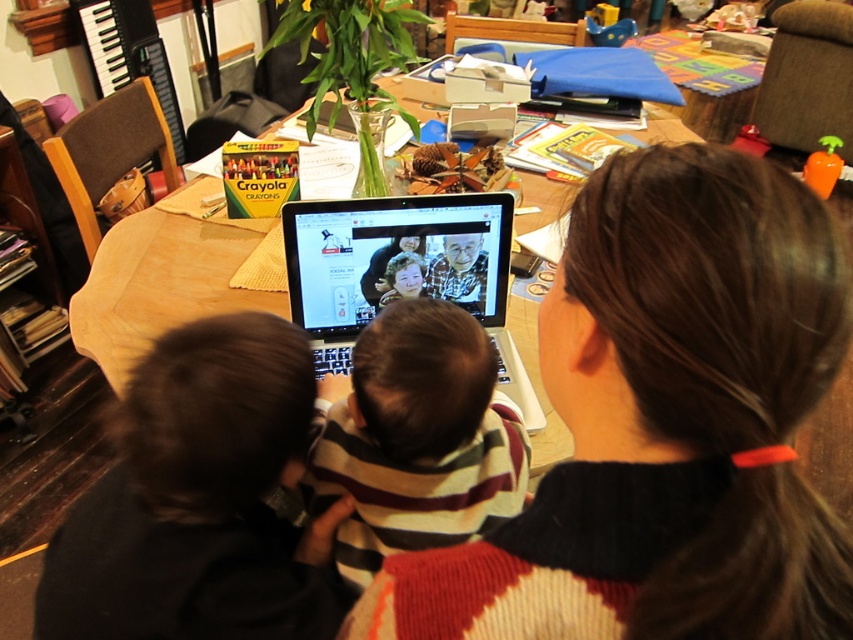
Question: Is striped sweater at center positioned before wooden table at center?

Choices:
 (A) yes
 (B) no

Answer: (A)

Question: Considering the relative positions of dark brown hair at center and wooden table at center in the image provided, where is dark brown hair at center located with respect to wooden table at center?

Choices:
 (A) left
 (B) right

Answer: (B)

Question: Based on their relative distances, which object is farther from the dark brown hair at center?

Choices:
 (A) striped sweater at center
 (B) black plastic laptop at center

Answer: (B)

Question: Can you confirm if dark brown hair at center is positioned above striped sweater at center?

Choices:
 (A) yes
 (B) no

Answer: (B)

Question: Based on their relative distances, which object is farther from the black plastic laptop at center?

Choices:
 (A) dark brown hair at center
 (B) wooden table at center
 (C) striped sweater at center

Answer: (A)

Question: Which point is closer to the camera?

Choices:
 (A) black plastic laptop at center
 (B) wooden table at center

Answer: (A)